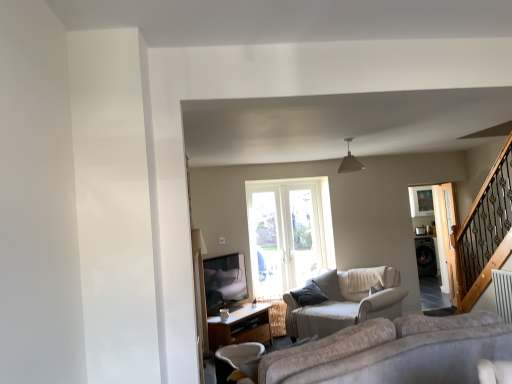
This screenshot has height=384, width=512. Describe the element at coordinates (442, 230) in the screenshot. I see `clear glass screen door at right, the 1th screen door when ordered from back to front` at that location.

Find the location of a particular element. The width and height of the screenshot is (512, 384). clear glass screen door at right, acting as the 2th screen door starting from the front is located at coordinates (442, 230).

Image resolution: width=512 pixels, height=384 pixels. What do you see at coordinates (346, 302) in the screenshot?
I see `beige fabric studio couch at center` at bounding box center [346, 302].

Find the location of `black glossy washing machine at right`. black glossy washing machine at right is located at coordinates (426, 256).

Where is `clear glass screen door at right, the 1th screen door when ordered from back to front`? The image size is (512, 384). clear glass screen door at right, the 1th screen door when ordered from back to front is located at coordinates (442, 230).

From a real-world perspective, is beige fabric studio couch at center on top of clear glass screen door at right, the second screen door positioned from the back?

Incorrect, from a real-world perspective, beige fabric studio couch at center is lower than clear glass screen door at right, the second screen door positioned from the back.

How different are the orientations of beige fabric studio couch at center and clear glass screen door at right, the second screen door positioned from the back, in degrees?

The angular difference between beige fabric studio couch at center and clear glass screen door at right, the second screen door positioned from the back, is 45.5 degrees.

From their relative heights in the image, would you say beige fabric studio couch at center is taller or shorter than clear glass screen door at right, the second screen door positioned from the back?

Clearly, beige fabric studio couch at center is shorter compared to clear glass screen door at right, the second screen door positioned from the back.

Considering the positions of point (333, 304) and point (450, 277), is point (333, 304) closer or farther from the camera than point (450, 277)?

Clearly, point (333, 304) is closer to the camera than point (450, 277).

Who is taller, clear glass screen door at right, the second screen door positioned from the back, or black glossy washing machine at right?

clear glass screen door at right, the second screen door positioned from the back.

Based on the photo, from the image's perspective, does clear glass screen door at right, the second screen door positioned from the back, appear higher than black glossy washing machine at right?

Indeed, from the image's perspective, clear glass screen door at right, the second screen door positioned from the back, is shown above black glossy washing machine at right.

Considering their positions, is clear glass screen door at right, the second screen door positioned from the back, located in front of or behind black glossy washing machine at right?

Visually, clear glass screen door at right, the second screen door positioned from the back, is located in front of black glossy washing machine at right.

Is white fabric chair at lower center in contact with black glossy washing machine at right?

No.

From the image's perspective, would you say white fabric chair at lower center is positioned over black glossy washing machine at right?

No, from the image's perspective, white fabric chair at lower center is not on top of black glossy washing machine at right.

Which point is more forward, (221, 381) or (426, 249)?

Positioned in front is point (221, 381).

How much distance is there between white fabric chair at lower center and black glossy washing machine at right?

white fabric chair at lower center is 3.08 meters away from black glossy washing machine at right.

Is beige fabric studio couch at center turned away from clear glass screen door at right, the 1th screen door when ordered from back to front?

Yes, beige fabric studio couch at center's orientation is away from clear glass screen door at right, the 1th screen door when ordered from back to front.

Is point (365, 319) closer or farther from the camera than point (431, 189)?

Clearly, point (365, 319) is closer to the camera than point (431, 189).

Consider the image. Which object is wider, beige fabric studio couch at center or clear glass screen door at right, the 1th screen door when ordered from back to front?

With larger width is beige fabric studio couch at center.

Is point (219, 348) positioned in front of point (248, 317)?

Yes, it is.

Is white fabric chair at lower center taller than wooden table at lower center?

No, white fabric chair at lower center is not taller than wooden table at lower center.

Does white fabric chair at lower center lie in front of wooden table at lower center?

Yes, it is.

Is white fabric chair at lower center facing towards wooden table at lower center?

No.

Is black glossy washing machine at right looking in the opposite direction of beige fabric studio couch at center?

No.

From a real-world perspective, between black glossy washing machine at right and beige fabric studio couch at center, who is vertically higher?

beige fabric studio couch at center, from a real-world perspective.

Is black glossy washing machine at right to the right of beige fabric studio couch at center from the viewer's perspective?

Yes.

Is point (419, 265) less distant than point (324, 319)?

That is False.

Find the location of a particular element. The width and height of the screenshot is (512, 384). screen door that is the 2nd object to the right of the white fabric chair at lower center, starting at the anchor is located at coordinates (450, 238).

Is white fabric chair at lower center positioned with its back to clear glass screen door at right, which appears as the first screen door when viewed from the front?

No, clear glass screen door at right, which appears as the first screen door when viewed from the front, is not at the back of white fabric chair at lower center.

How different are the orientations of white fabric chair at lower center and clear glass screen door at right, the second screen door positioned from the back, in degrees?

178 degrees separate the facing orientations of white fabric chair at lower center and clear glass screen door at right, the second screen door positioned from the back.

Which is correct: white fabric chair at lower center is inside clear glass screen door at right, the second screen door positioned from the back, or outside of it?

white fabric chair at lower center is not inside clear glass screen door at right, the second screen door positioned from the back, it's outside.

Which screen door is the 2nd one when counting from the right side of the beige fabric studio couch at center? Please provide its 2D coordinates.

[(450, 238)]

Where is `appliance behind the clear glass screen door at right, which appears as the first screen door when viewed from the front`? Image resolution: width=512 pixels, height=384 pixels. appliance behind the clear glass screen door at right, which appears as the first screen door when viewed from the front is located at coordinates (426, 256).

Looking at the image, which one is located closer to black glossy washing machine at right, clear glass screen door at right, which appears as the first screen door when viewed from the front, or wooden table at lower center?

Among the two, clear glass screen door at right, which appears as the first screen door when viewed from the front, is located nearer to black glossy washing machine at right.

Looking at the image, which one is located further to beige fabric studio couch at center, white fabric chair at lower center or clear glass screen door at right, the second screen door positioned from the back?

clear glass screen door at right, the second screen door positioned from the back.

When comparing their distances from clear glass screen door at right, which appears as the first screen door when viewed from the front, does wooden table at lower center or white fabric chair at lower center seem further?

The object further to clear glass screen door at right, which appears as the first screen door when viewed from the front, is white fabric chair at lower center.

When comparing their distances from wooden table at lower center, does black glossy washing machine at right or white fabric chair at lower center seem closer?

Among the two, white fabric chair at lower center is located nearer to wooden table at lower center.

Estimate the real-world distances between objects in this image. Which object is further from black glossy washing machine at right, clear glass screen door at right, the second screen door positioned from the back, or clear glass screen door at right, the 1th screen door when ordered from back to front?

clear glass screen door at right, the second screen door positioned from the back.

When comparing their distances from clear glass screen door at right, acting as the 2th screen door starting from the front, does black glossy washing machine at right or wooden table at lower center seem closer?

black glossy washing machine at right is closer to clear glass screen door at right, acting as the 2th screen door starting from the front.

Looking at the image, which one is located further to black glossy washing machine at right, clear glass screen door at right, the 1th screen door when ordered from back to front, or beige fabric studio couch at center?

Based on the image, beige fabric studio couch at center appears to be further to black glossy washing machine at right.

When comparing their distances from wooden table at lower center, does clear glass screen door at right, acting as the 2th screen door starting from the front, or white fabric chair at lower center seem closer?

white fabric chair at lower center lies closer to wooden table at lower center than the other object.

Locate an element on the screen. This screenshot has height=384, width=512. table located between white fabric chair at lower center and black glossy washing machine at right in the depth direction is located at coordinates (240, 327).

This screenshot has width=512, height=384. I want to click on studio couch between white fabric chair at lower center and clear glass screen door at right, the second screen door positioned from the back, in the horizontal direction, so click(x=346, y=302).

The width and height of the screenshot is (512, 384). What are the coordinates of `screen door located between white fabric chair at lower center and clear glass screen door at right, the second screen door positioned from the back, in the left-right direction` in the screenshot? It's located at (442, 230).

Locate an element on the screen. chair between wooden table at lower center and beige fabric studio couch at center in the horizontal direction is located at coordinates (234, 358).